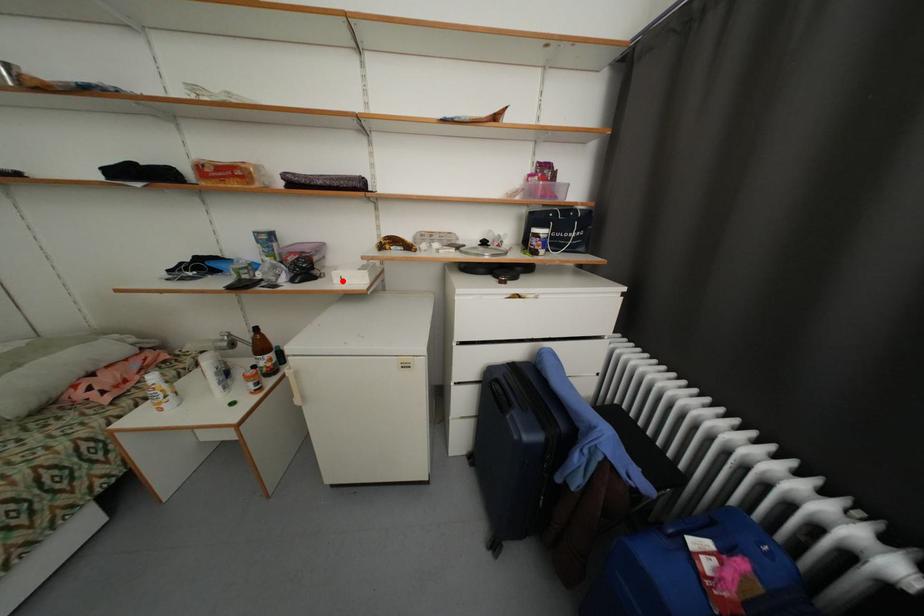
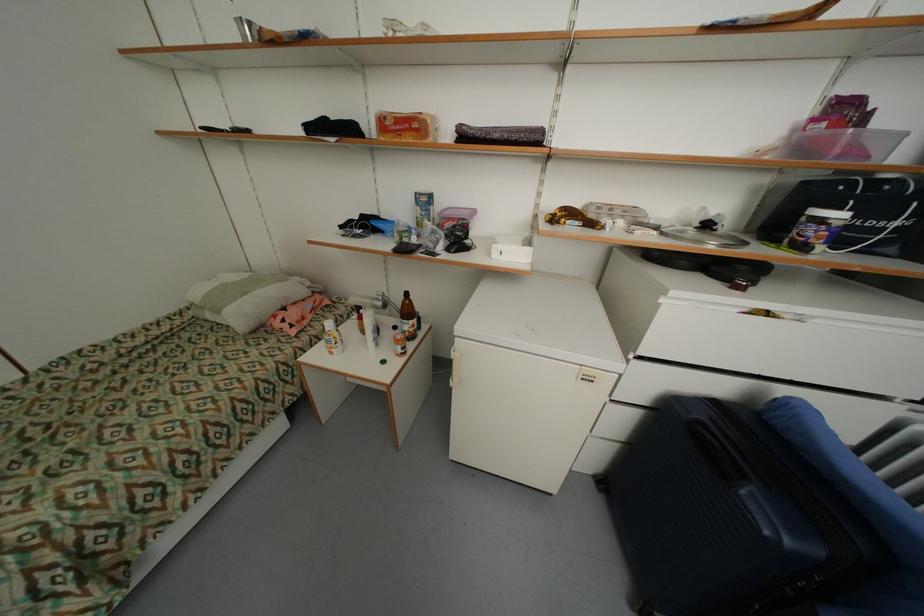
Locate, in the second image, the point that corresponds to the highlighted location in the first image.

(502, 256)